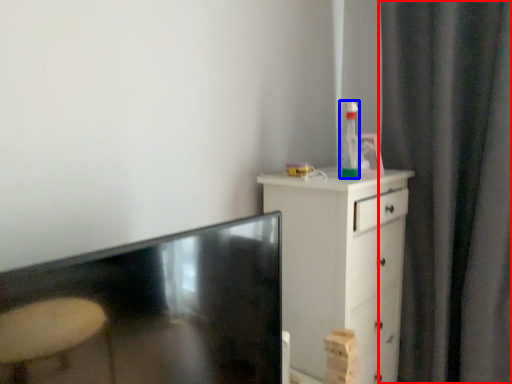
Question: Which of the following is the closest to the observer, curtain (highlighted by a red box) or bottle (highlighted by a blue box)?

Choices:
 (A) curtain
 (B) bottle

Answer: (A)